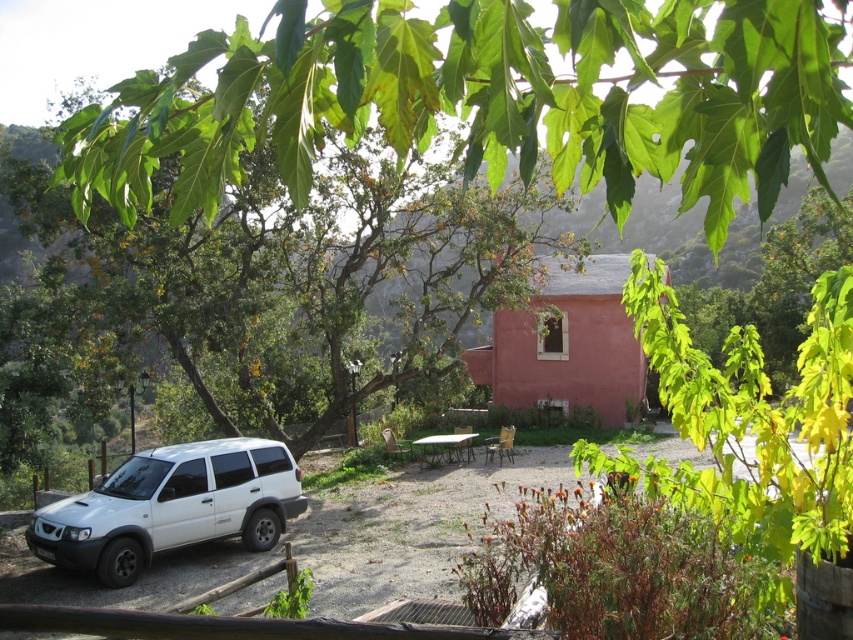
You are planning to move the white matte suv at lower left and the wooden picnic table at center to a new location. If you need to prioritize moving the larger item first, which one should you move first?

The white matte suv at lower left is bigger than wooden picnic table at center, so you should move the white matte suv at lower left first.

You are standing in front of the house and notice two points marked in the scene. Which point is closer to you, point (810, 84) or point (202, 358)?

Point (810, 84) is closer to the viewer than point (202, 358).

You are planning to set up a picnic table in the backyard of the pinkish house. Based on the image, which object is smaller in size between the green leafy tree at upper center and the wooden picnic table at center?

The green leafy tree at upper center is smaller than the wooden picnic table at center according to the description.